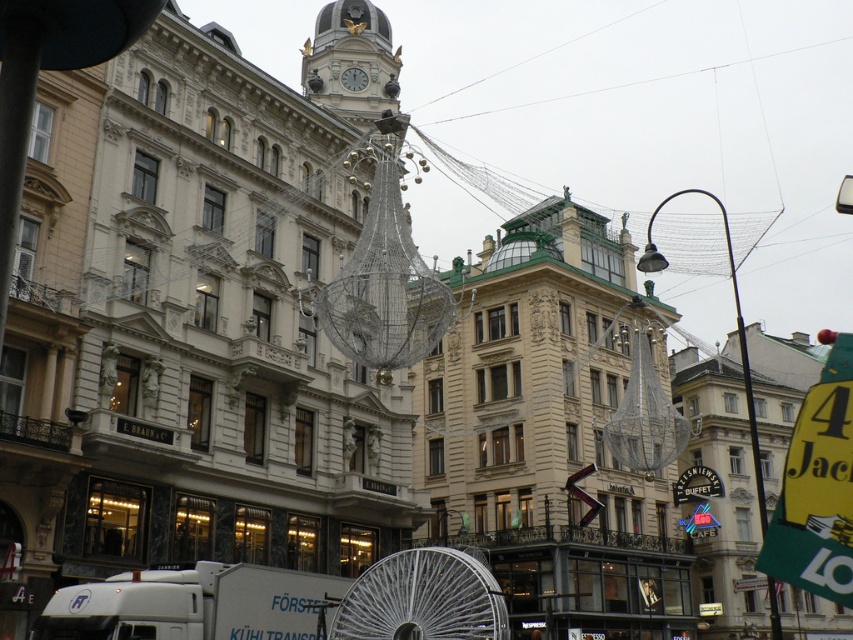
You are standing at the entrance of the grand building and want to take a photo of the gold ornate clock tower at upper center. The camera you have can focus on objects up to 100 meters away. Will the clock tower be in focus?

The gold ornate clock tower at upper center is 83.67 meters away from the camera. Since the camera can focus up to 100 meters, the clock tower will be within the focus range and should be in focus.

You are standing in the middle of the square facing the grand building with the gold ornate clock tower at upper center. A friend tells you they are standing at coordinates point A, which is at position 0.097 on the x and 0.413 on the y. Are they standing at the base of the clock tower or at the top of the clock tower?

The gold ornate clock tower at upper center is located at point (351, 61), so your friend is standing at the top of the clock tower.

You are an architect analyzing the urban scene. You need to determine the spatial relationship between the gold ornate clock tower at upper center and the metallic pole at right. Which object is positioned higher in the image?

The gold ornate clock tower at upper center is positioned higher than the metallic pole at right because it is located above it.